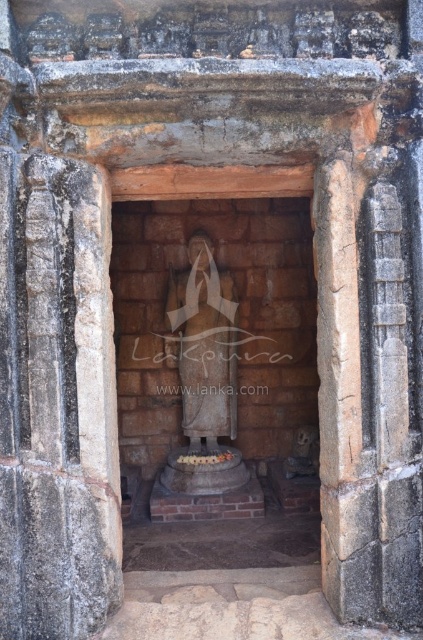
Question: Does brown stone statue at center have a smaller size compared to stone statue at center?

Choices:
 (A) yes
 (B) no

Answer: (B)

Question: Does brown stone statue at center have a lesser width compared to stone statue at center?

Choices:
 (A) no
 (B) yes

Answer: (A)

Question: Is brown stone statue at center positioned at the back of stone statue at center?

Choices:
 (A) no
 (B) yes

Answer: (A)

Question: Which of the following is the farthest from the observer?

Choices:
 (A) (231, 342)
 (B) (126, 198)

Answer: (A)